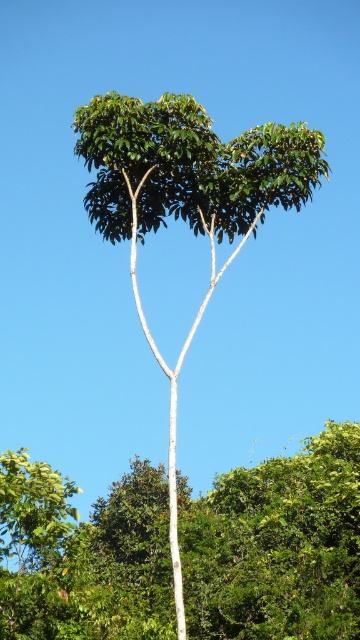
Consider the image. Does green leafy tree at center appear over green matte tree at center?

Incorrect, green leafy tree at center is not positioned above green matte tree at center.

Where is `green leafy tree at center`? The width and height of the screenshot is (360, 640). green leafy tree at center is located at coordinates (276, 545).